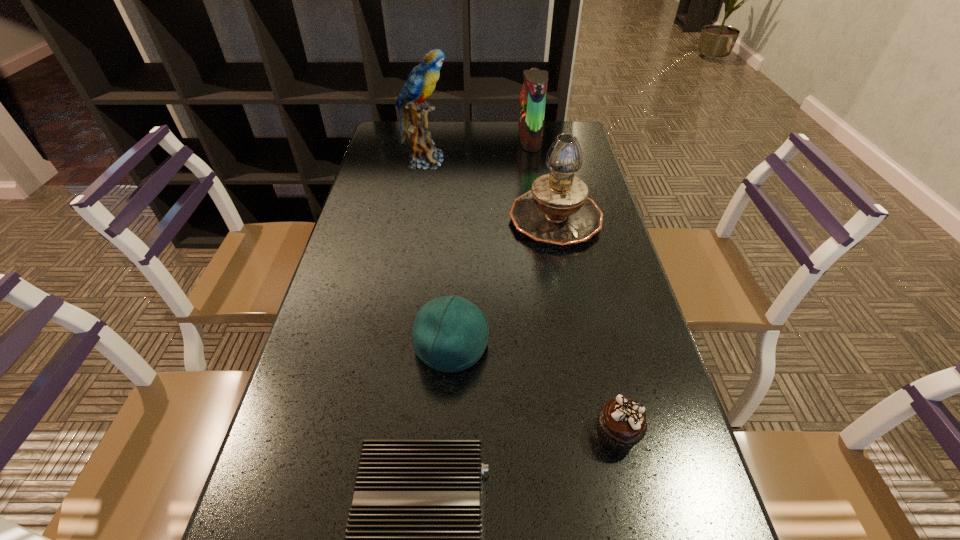
The width and height of the screenshot is (960, 540). Identify the location of object that stands as the closest to the fifth tallest object. (413, 539).

I want to click on vacant space that satisfies the following two spatial constraints: 1. at the face of the oil lamp; 2. on the right side of the shorter parrot, so click(542, 218).

Find the location of a particular element. This screenshot has width=960, height=540. vacant point that satisfies the following two spatial constraints: 1. on the face of the second shortest object; 2. on the right side of the taller parrot is located at coordinates (379, 434).

Locate an element on the screen. The image size is (960, 540). vacant area that satisfies the following two spatial constraints: 1. at the face of the cupcake; 2. on the left side of the shorter parrot is located at coordinates (578, 434).

Where is `free location that satisfies the following two spatial constraints: 1. on the face of the taller parrot; 2. on the right side of the fifth tallest object`? free location that satisfies the following two spatial constraints: 1. on the face of the taller parrot; 2. on the right side of the fifth tallest object is located at coordinates (379, 434).